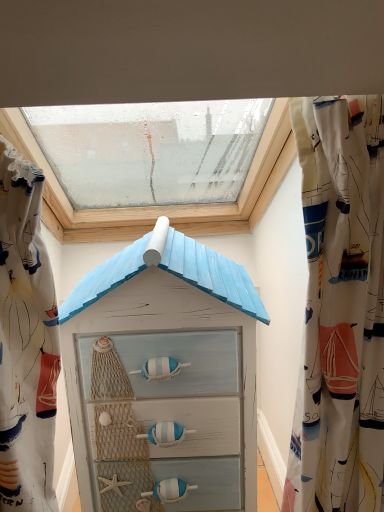
Image resolution: width=384 pixels, height=512 pixels. Describe the element at coordinates (26, 342) in the screenshot. I see `white sailboat-patterned fabric at upper left, positioned as the first curtain in left-to-right order` at that location.

This screenshot has height=512, width=384. What do you see at coordinates (163, 378) in the screenshot?
I see `light blue painted wood at center` at bounding box center [163, 378].

What do you see at coordinates (164, 205) in the screenshot? The width and height of the screenshot is (384, 512). I see `transparent glass window at upper center` at bounding box center [164, 205].

I want to click on white sailboat-patterned fabric at upper left, the 2th curtain when ordered from right to left, so click(x=26, y=342).

Which object is further away from the camera, white fabric with nautical prints at right, the second curtain positioned from the left, or white sailboat-patterned fabric at upper left, positioned as the first curtain in left-to-right order?

white fabric with nautical prints at right, the second curtain positioned from the left, is further away from the camera.

Is white fabric with nautical prints at right, placed as the first curtain when sorted from right to left, oriented towards white sailboat-patterned fabric at upper left, positioned as the first curtain in left-to-right order?

No, white fabric with nautical prints at right, placed as the first curtain when sorted from right to left, is not aimed at white sailboat-patterned fabric at upper left, positioned as the first curtain in left-to-right order.

This screenshot has height=512, width=384. What are the coordinates of `curtain above the white fabric with nautical prints at right, the second curtain positioned from the left (from a real-world perspective)` in the screenshot? It's located at (26, 342).

Which is more distant, (368,122) or (88,218)?

The point (88,218) is more distant.

Based on the photo, can you confirm if white fabric with nautical prints at right, placed as the first curtain when sorted from right to left, is taller than transparent glass window at upper center?

Yes, white fabric with nautical prints at right, placed as the first curtain when sorted from right to left, is taller than transparent glass window at upper center.

Is transparent glass window at upper center completely or partially inside white fabric with nautical prints at right, placed as the first curtain when sorted from right to left?

No, transparent glass window at upper center is not surrounded by white fabric with nautical prints at right, placed as the first curtain when sorted from right to left.

Considering the sizes of white fabric with nautical prints at right, placed as the first curtain when sorted from right to left, and transparent glass window at upper center in the image, is white fabric with nautical prints at right, placed as the first curtain when sorted from right to left, bigger or smaller than transparent glass window at upper center?

white fabric with nautical prints at right, placed as the first curtain when sorted from right to left, is smaller than transparent glass window at upper center.

Does white fabric with nautical prints at right, the second curtain positioned from the left, have a greater height compared to light blue painted wood at center?

No, white fabric with nautical prints at right, the second curtain positioned from the left, is not taller than light blue painted wood at center.

Considering the relative sizes of white fabric with nautical prints at right, the second curtain positioned from the left, and light blue painted wood at center in the image provided, is white fabric with nautical prints at right, the second curtain positioned from the left, bigger than light blue painted wood at center?

Actually, white fabric with nautical prints at right, the second curtain positioned from the left, might be smaller than light blue painted wood at center.

From the image's perspective, is white fabric with nautical prints at right, placed as the first curtain when sorted from right to left, above or below light blue painted wood at center?

Based on their image positions, white fabric with nautical prints at right, placed as the first curtain when sorted from right to left, is located above light blue painted wood at center.

Is white fabric with nautical prints at right, placed as the first curtain when sorted from right to left, not within light blue painted wood at center?

That's correct, white fabric with nautical prints at right, placed as the first curtain when sorted from right to left, is outside of light blue painted wood at center.

What's the angular difference between white sailboat-patterned fabric at upper left, the 2th curtain when ordered from right to left, and light blue painted wood at center's facing directions?

The angular difference between white sailboat-patterned fabric at upper left, the 2th curtain when ordered from right to left, and light blue painted wood at center is 3.32 degrees.

Considering the relative sizes of white sailboat-patterned fabric at upper left, the 2th curtain when ordered from right to left, and light blue painted wood at center in the image provided, is white sailboat-patterned fabric at upper left, the 2th curtain when ordered from right to left, shorter than light blue painted wood at center?

Yes.

Considering the sizes of objects white sailboat-patterned fabric at upper left, positioned as the first curtain in left-to-right order, and light blue painted wood at center in the image provided, who is wider, white sailboat-patterned fabric at upper left, positioned as the first curtain in left-to-right order, or light blue painted wood at center?

light blue painted wood at center.

Are transparent glass window at upper center and white sailboat-patterned fabric at upper left, positioned as the first curtain in left-to-right order, beside each other?

No, transparent glass window at upper center is not making contact with white sailboat-patterned fabric at upper left, positioned as the first curtain in left-to-right order.

Looking at the image, does transparent glass window at upper center seem bigger or smaller compared to white sailboat-patterned fabric at upper left, positioned as the first curtain in left-to-right order?

Clearly, transparent glass window at upper center is larger in size than white sailboat-patterned fabric at upper left, positioned as the first curtain in left-to-right order.

Who is shorter, transparent glass window at upper center or white sailboat-patterned fabric at upper left, the 2th curtain when ordered from right to left?

Standing shorter between the two is transparent glass window at upper center.

From the image's perspective, is light blue painted wood at center located above or below white fabric with nautical prints at right, placed as the first curtain when sorted from right to left?

light blue painted wood at center is situated lower than white fabric with nautical prints at right, placed as the first curtain when sorted from right to left, in the image.

Is light blue painted wood at center facing away from white fabric with nautical prints at right, placed as the first curtain when sorted from right to left?

light blue painted wood at center does not have its back to white fabric with nautical prints at right, placed as the first curtain when sorted from right to left.

Considering the relative sizes of light blue painted wood at center and white fabric with nautical prints at right, the second curtain positioned from the left, in the image provided, is light blue painted wood at center wider than white fabric with nautical prints at right, the second curtain positioned from the left,?

Yes.

Considering the positions of objects light blue painted wood at center and white fabric with nautical prints at right, the second curtain positioned from the left, in the image provided, who is more to the right, light blue painted wood at center or white fabric with nautical prints at right, the second curtain positioned from the left,?

From the viewer's perspective, white fabric with nautical prints at right, the second curtain positioned from the left, appears more on the right side.

Is the surface of transparent glass window at upper center in direct contact with light blue painted wood at center?

transparent glass window at upper center and light blue painted wood at center are clearly separated.

Image resolution: width=384 pixels, height=512 pixels. Identify the location of beach hut below the transparent glass window at upper center (from the image's perspective). point(163,378).

Which of these two, transparent glass window at upper center or light blue painted wood at center, is bigger?

With larger size is transparent glass window at upper center.

Locate an element on the screen. The image size is (384, 512). curtain located below the white sailboat-patterned fabric at upper left, positioned as the first curtain in left-to-right order (from the image's perspective) is located at coordinates (340, 308).

Where is `the 2nd curtain directly beneath the transparent glass window at upper center (from a real-world perspective)`? This screenshot has width=384, height=512. the 2nd curtain directly beneath the transparent glass window at upper center (from a real-world perspective) is located at coordinates (340, 308).

Looking at the image, which one is located closer to white sailboat-patterned fabric at upper left, the 2th curtain when ordered from right to left, white fabric with nautical prints at right, placed as the first curtain when sorted from right to left, or light blue painted wood at center?

Among the two, light blue painted wood at center is located nearer to white sailboat-patterned fabric at upper left, the 2th curtain when ordered from right to left.

Looking at the image, which one is located closer to light blue painted wood at center, white sailboat-patterned fabric at upper left, the 2th curtain when ordered from right to left, or white fabric with nautical prints at right, the second curtain positioned from the left?

Based on the image, white sailboat-patterned fabric at upper left, the 2th curtain when ordered from right to left, appears to be nearer to light blue painted wood at center.

From the picture: Considering their positions, is light blue painted wood at center positioned closer to transparent glass window at upper center than white sailboat-patterned fabric at upper left, the 2th curtain when ordered from right to left?

light blue painted wood at center is closer to transparent glass window at upper center.

Which object lies further to the anchor point white fabric with nautical prints at right, the second curtain positioned from the left, transparent glass window at upper center or light blue painted wood at center?

transparent glass window at upper center is further to white fabric with nautical prints at right, the second curtain positioned from the left.

Looking at this image, from the image, which object appears to be nearer to white sailboat-patterned fabric at upper left, the 2th curtain when ordered from right to left, light blue painted wood at center or transparent glass window at upper center?

light blue painted wood at center is closer to white sailboat-patterned fabric at upper left, the 2th curtain when ordered from right to left.

Looking at the image, which one is located further to light blue painted wood at center, white fabric with nautical prints at right, the second curtain positioned from the left, or transparent glass window at upper center?

Based on the image, transparent glass window at upper center appears to be further to light blue painted wood at center.

Considering their positions, is white fabric with nautical prints at right, the second curtain positioned from the left, positioned closer to light blue painted wood at center than white sailboat-patterned fabric at upper left, the 2th curtain when ordered from right to left?

The object closer to light blue painted wood at center is white sailboat-patterned fabric at upper left, the 2th curtain when ordered from right to left.

From the image, which object appears to be farther from white fabric with nautical prints at right, placed as the first curtain when sorted from right to left, light blue painted wood at center or white sailboat-patterned fabric at upper left, the 2th curtain when ordered from right to left?

white sailboat-patterned fabric at upper left, the 2th curtain when ordered from right to left, is further to white fabric with nautical prints at right, placed as the first curtain when sorted from right to left.

Where is `beach hut between white sailboat-patterned fabric at upper left, the 2th curtain when ordered from right to left, and white fabric with nautical prints at right, the second curtain positioned from the left, from left to right`? beach hut between white sailboat-patterned fabric at upper left, the 2th curtain when ordered from right to left, and white fabric with nautical prints at right, the second curtain positioned from the left, from left to right is located at coordinates (163, 378).

The image size is (384, 512). Find the location of `curtain between white sailboat-patterned fabric at upper left, the 2th curtain when ordered from right to left, and transparent glass window at upper center from front to back`. curtain between white sailboat-patterned fabric at upper left, the 2th curtain when ordered from right to left, and transparent glass window at upper center from front to back is located at coordinates (340, 308).